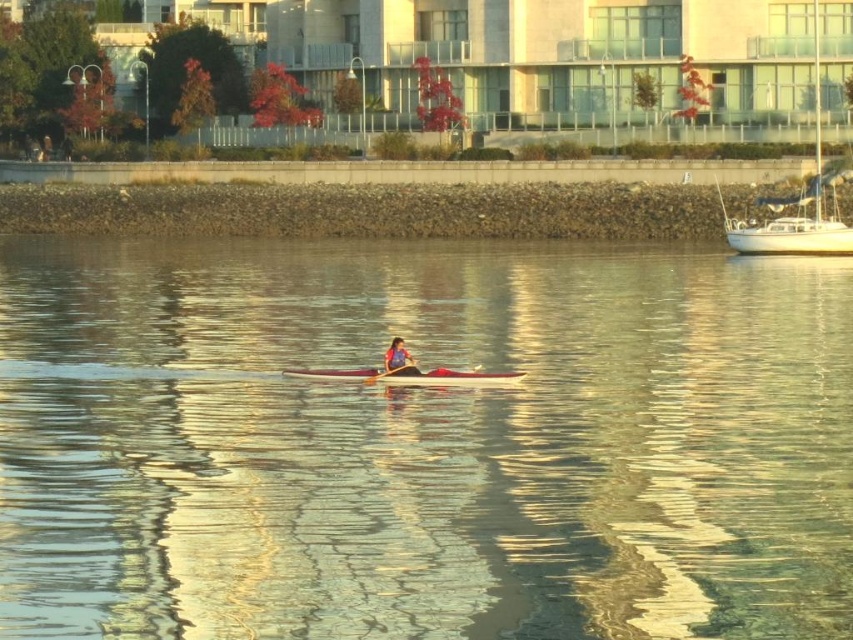
You are a photographer planning to take a photo of the white glossy sailboat at right and the white glossy kayak at center. Based on their positions, which object should you position your camera closer to in order to capture both in the same frame?

The white glossy sailboat at right is to the right of the white glossy kayak at center, so you should position your camera closer to the center to include both objects in the frame.